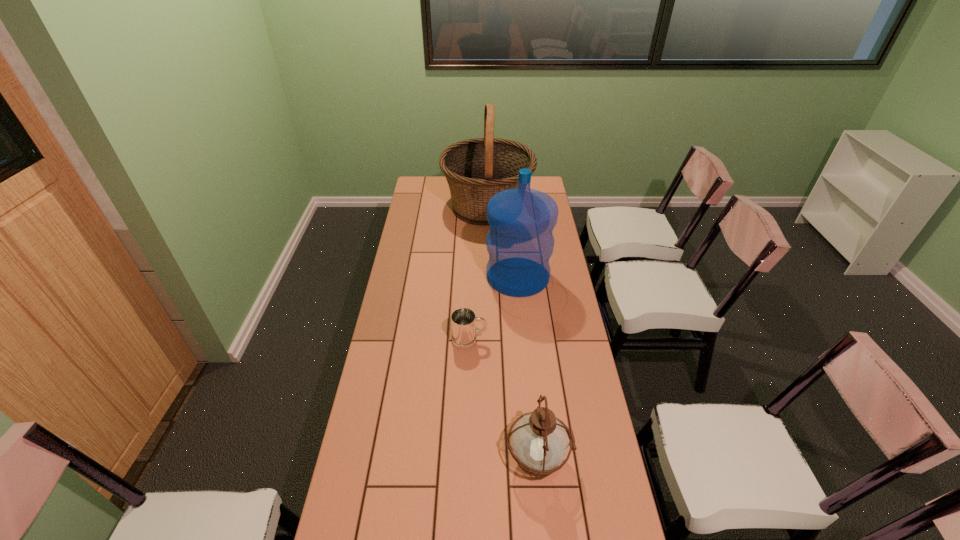
This screenshot has height=540, width=960. Identify the location of the farthest object. (476, 169).

At what (x,y) coordinates should I click in order to perform the action: click on the third nearest object. Please return your answer as a coordinate pair (x, y). Image resolution: width=960 pixels, height=540 pixels. Looking at the image, I should click on (520, 242).

At what (x,y) coordinates should I click in order to perform the action: click on the third tallest object. Please return your answer as a coordinate pair (x, y). Looking at the image, I should click on (539, 441).

Identify the location of the nearest object. The image size is (960, 540). tap(539, 441).

Where is `the shortest object`? the shortest object is located at coordinates (463, 320).

Where is `mug`? mug is located at coordinates (463, 320).

Where is `free spot located on the front of the basket`? The height and width of the screenshot is (540, 960). free spot located on the front of the basket is located at coordinates (489, 281).

I want to click on vacant region located on the front of the water jug, so click(521, 310).

The height and width of the screenshot is (540, 960). Find the location of `free spot located 0.260m on the back of the oil lamp`. free spot located 0.260m on the back of the oil lamp is located at coordinates tap(529, 363).

Locate an element on the screen. vacant region located 0.340m on the side of the shortest object with the handle is located at coordinates (577, 340).